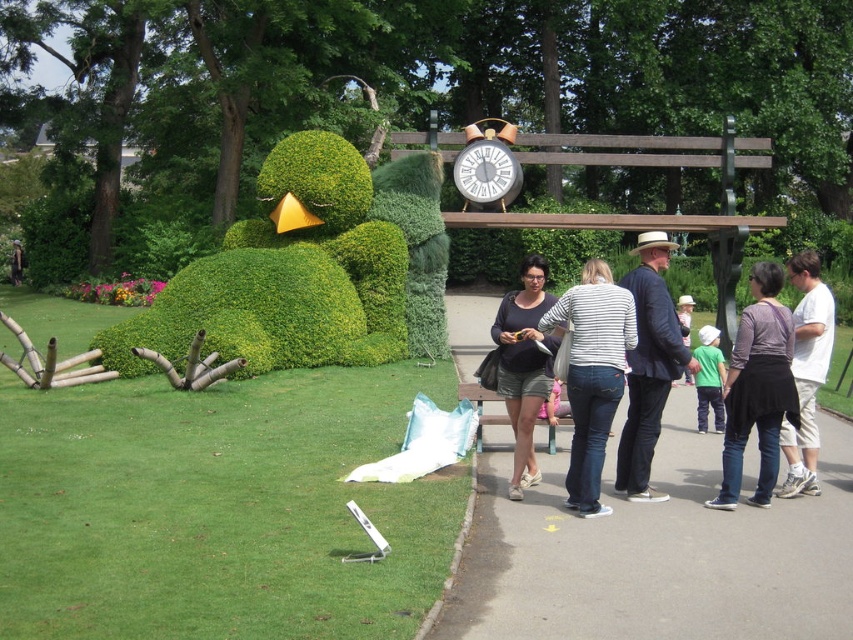
You are standing in a park and see two shirts hanging on a clothesline between two trees. The shirts are the striped cotton shirt at center and the white cotton shirt at center. Which shirt is positioned lower on the clothesline?

The striped cotton shirt at center is below the white cotton shirt at center, so the striped cotton shirt at center is positioned lower on the clothesline.